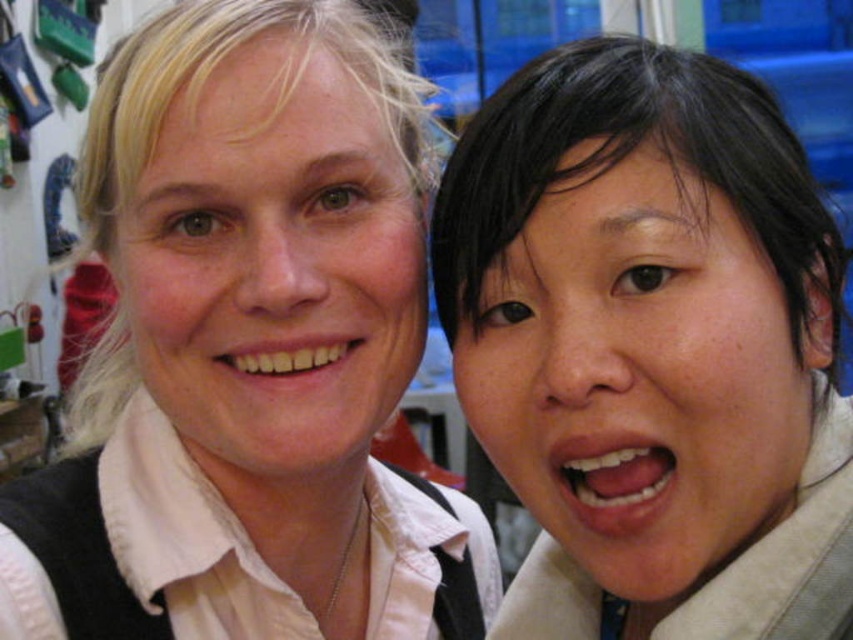
Question: Is matte white shirt at center wider than smooth skin face at right?

Choices:
 (A) yes
 (B) no

Answer: (A)

Question: Is smooth skin face at right thinner than matte white face at upper left?

Choices:
 (A) yes
 (B) no

Answer: (B)

Question: Which point appears farthest from the camera in this image?

Choices:
 (A) (212, 385)
 (B) (607, 500)
 (C) (288, 204)
 (D) (608, 552)

Answer: (A)

Question: Is matte white shirt at center positioned at the back of matte white face at upper left?

Choices:
 (A) no
 (B) yes

Answer: (B)

Question: Which object is closer to the camera taking this photo?

Choices:
 (A) white glossy teeth at lower right
 (B) matte white shirt at center
 (C) smooth skin face at right
 (D) white glossy teeth at center

Answer: (C)

Question: Which of the following is the closest to the observer?

Choices:
 (A) (262, 353)
 (B) (74, 387)

Answer: (A)